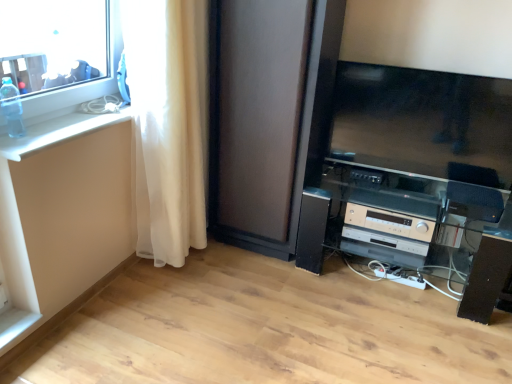
Locate an element on the screen. The image size is (512, 384). empty space that is to the right of transparent plastic bottle at upper left is located at coordinates (61, 133).